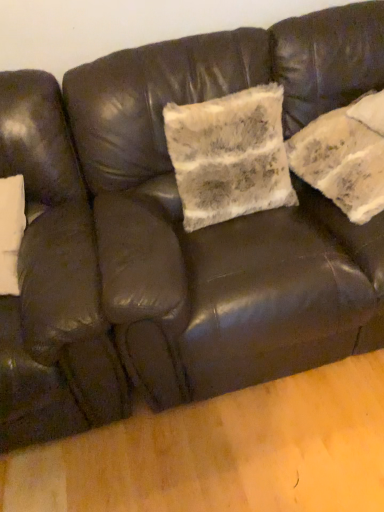
Describe the element at coordinates (345, 156) in the screenshot. This screenshot has height=512, width=384. I see `fuzzy white pillow at center` at that location.

Identify the location of fuzzy white pillow at center. (345, 156).

Where is `matte black armchair at left`? The height and width of the screenshot is (512, 384). matte black armchair at left is located at coordinates (52, 282).

This screenshot has width=384, height=512. Describe the element at coordinates (52, 282) in the screenshot. I see `matte black armchair at left` at that location.

This screenshot has height=512, width=384. Identify the location of fuzzy white pillow at center. (345, 156).

From the picture: Considering the positions of objects matte black armchair at left and fuzzy white pillow at center in the image provided, who is more to the left, matte black armchair at left or fuzzy white pillow at center?

Positioned to the left is matte black armchair at left.

Is matte black armchair at left positioned in front of fuzzy white pillow at center?

Yes, the depth of matte black armchair at left is less than that of fuzzy white pillow at center.

Considering the points (22, 330) and (307, 131), which point is behind, point (22, 330) or point (307, 131)?

Positioned behind is point (307, 131).

From the image's perspective, would you say matte black armchair at left is shown under fuzzy white pillow at center?

Correct, matte black armchair at left appears lower than fuzzy white pillow at center in the image.

From a real-world perspective, is matte black armchair at left below fuzzy white pillow at center?

Yes, from a real-world perspective, matte black armchair at left is under fuzzy white pillow at center.

Between matte black armchair at left and fuzzy white pillow at center, which one has smaller width?

With smaller width is fuzzy white pillow at center.

Considering the relative sizes of matte black armchair at left and fuzzy white pillow at center in the image provided, is matte black armchair at left shorter than fuzzy white pillow at center?

Incorrect, the height of matte black armchair at left does not fall short of that of fuzzy white pillow at center.

In terms of size, does matte black armchair at left appear bigger or smaller than fuzzy white pillow at center?

matte black armchair at left is bigger than fuzzy white pillow at center.

Which is correct: matte black armchair at left is inside fuzzy white pillow at center, or outside of it?

matte black armchair at left is spatially situated outside fuzzy white pillow at center.

Would you say matte black armchair at left is a long distance from fuzzy white pillow at center?

matte black armchair at left is near fuzzy white pillow at center, not far away.

Is matte black armchair at left facing towards fuzzy white pillow at center?

No, matte black armchair at left is not aimed at fuzzy white pillow at center.

How different are the orientations of matte black armchair at left and fuzzy white pillow at center in degrees?

The facing directions of matte black armchair at left and fuzzy white pillow at center are 35.1 degrees apart.

The height and width of the screenshot is (512, 384). Identify the location of armchair to the left of fuzzy white pillow at center. (52, 282).

Is fuzzy white pillow at center at the left side of matte black armchair at left?

No, fuzzy white pillow at center is not to the left of matte black armchair at left.

Considering the relative positions of fuzzy white pillow at center and matte black armchair at left in the image provided, is fuzzy white pillow at center behind matte black armchair at left?

That is True.

Is point (362, 172) farther from camera compared to point (49, 287)?

Yes.

From the image's perspective, which object appears higher, fuzzy white pillow at center or matte black armchair at left?

fuzzy white pillow at center is shown above in the image.

From a real-world perspective, is fuzzy white pillow at center positioned above or below matte black armchair at left?

In terms of real-world spatial position, fuzzy white pillow at center is above matte black armchair at left.

Does fuzzy white pillow at center have a greater width compared to matte black armchair at left?

Incorrect, the width of fuzzy white pillow at center does not surpass that of matte black armchair at left.

Is fuzzy white pillow at center taller than matte black armchair at left?

In fact, fuzzy white pillow at center may be shorter than matte black armchair at left.

Which of these two, fuzzy white pillow at center or matte black armchair at left, is smaller?

fuzzy white pillow at center is smaller.

Is fuzzy white pillow at center outside of matte black armchair at left?

Yes, fuzzy white pillow at center is not within matte black armchair at left.

Consider the image. Is fuzzy white pillow at center with matte black armchair at left?

No, fuzzy white pillow at center is not with matte black armchair at left.

Is fuzzy white pillow at center turned away from matte black armchair at left?

No, fuzzy white pillow at center is not facing away from matte black armchair at left.

How many degrees apart are the facing directions of fuzzy white pillow at center and matte black armchair at left?

The angle between the facing direction of fuzzy white pillow at center and the facing direction of matte black armchair at left is 35.1 degrees.

Locate an element on the screen. armchair on the left of fuzzy white pillow at center is located at coordinates (52, 282).

Locate an element on the screen. The image size is (384, 512). armchair that appears below the fuzzy white pillow at center (from a real-world perspective) is located at coordinates (52, 282).

The width and height of the screenshot is (384, 512). What are the coordinates of `pillow positioned vertically above the matte black armchair at left (from a real-world perspective)` in the screenshot? It's located at (345, 156).